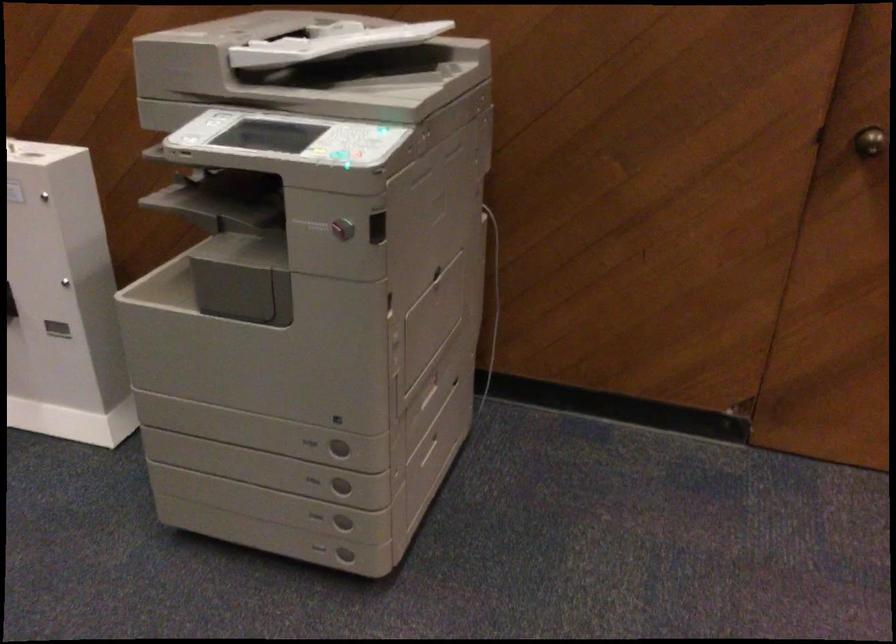
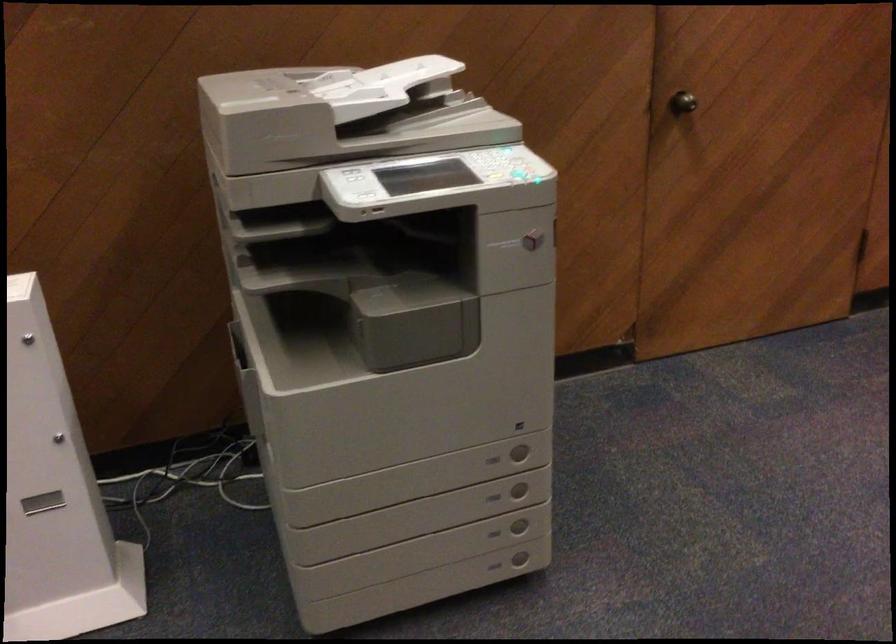
The point at (x=312, y=520) is marked in the first image. Where is the corresponding point in the second image?

(494, 533)